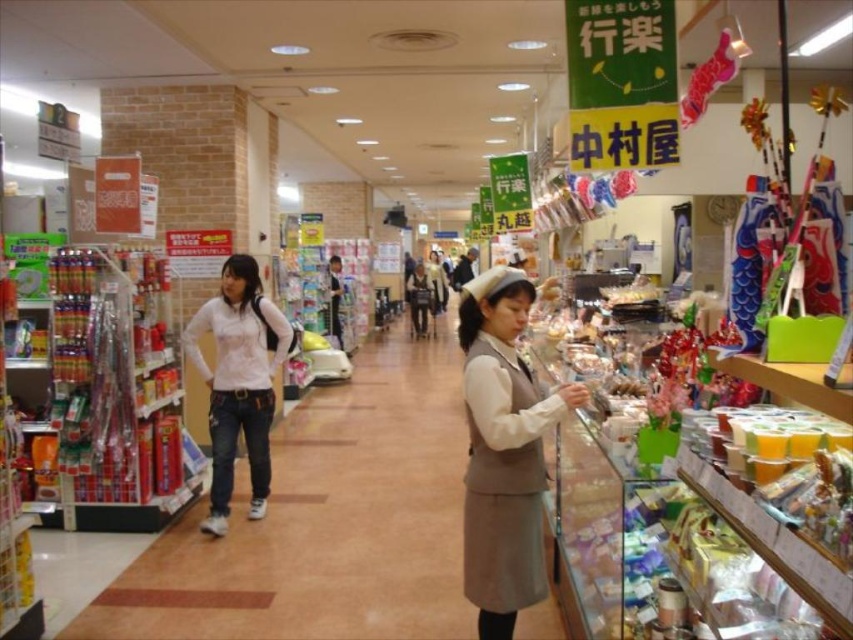
Question: In this image, where is denim jeans at left located relative to beige woolen dress at center?

Choices:
 (A) left
 (B) right

Answer: (A)

Question: Considering the real-world distances, which object is farthest from the beige woolen dress at center?

Choices:
 (A) denim jeans at left
 (B) white matte shirt at center

Answer: (A)

Question: Is denim jeans at left above beige woolen dress at center?

Choices:
 (A) yes
 (B) no

Answer: (B)

Question: Which object is farther from the camera taking this photo?

Choices:
 (A) denim jeans at left
 (B) beige woolen dress at center
 (C) white matte shirt at center

Answer: (C)

Question: Which of the following is the farthest from the observer?

Choices:
 (A) (97, 595)
 (B) (247, 362)

Answer: (B)

Question: Is the position of denim jeans at left less distant than that of white matte shirt at center?

Choices:
 (A) no
 (B) yes

Answer: (B)